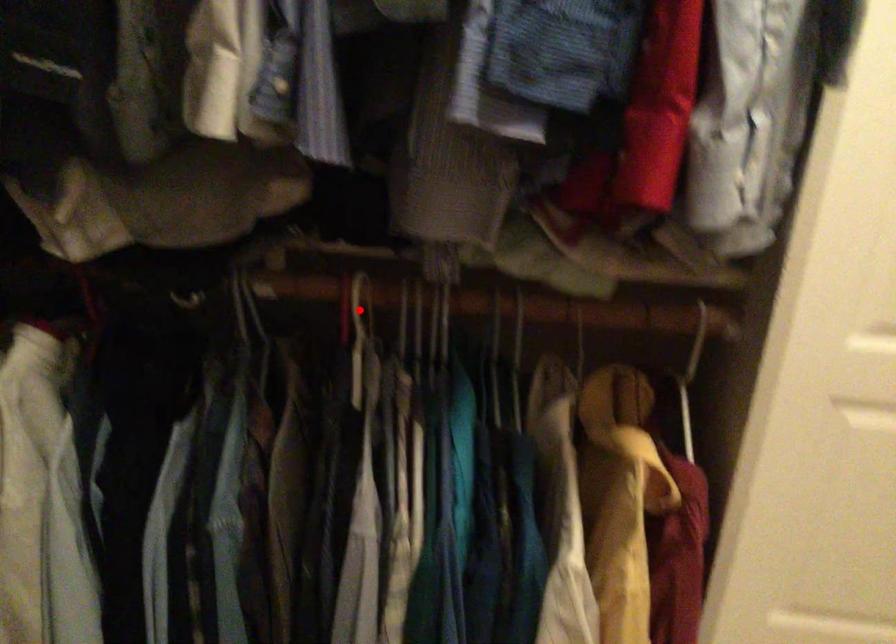
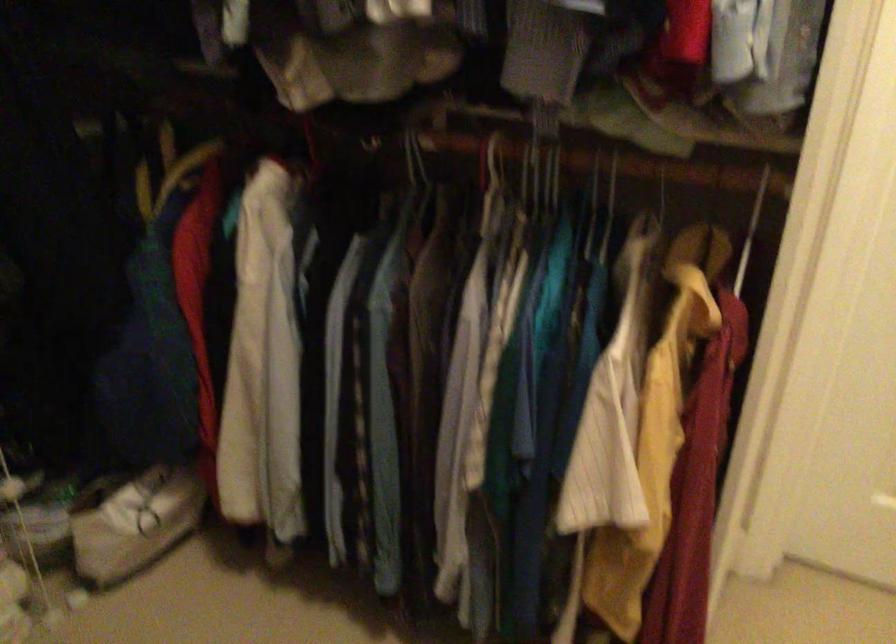
Question: I am providing you with two images of the same scene from different viewpoints. Given a red point in image1, look at the same physical point in image2. Is it:

Choices:
 (A) Closer to the viewpoint
 (B) Farther from the viewpoint

Answer: (B)